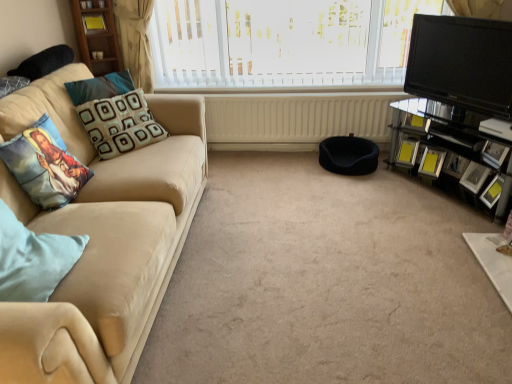
Find the location of a particular element. The height and width of the screenshot is (384, 512). empty space that is in between yellow paper at right, the 5th picture frame viewed from the front, and white glossy table at lower right is located at coordinates (443, 207).